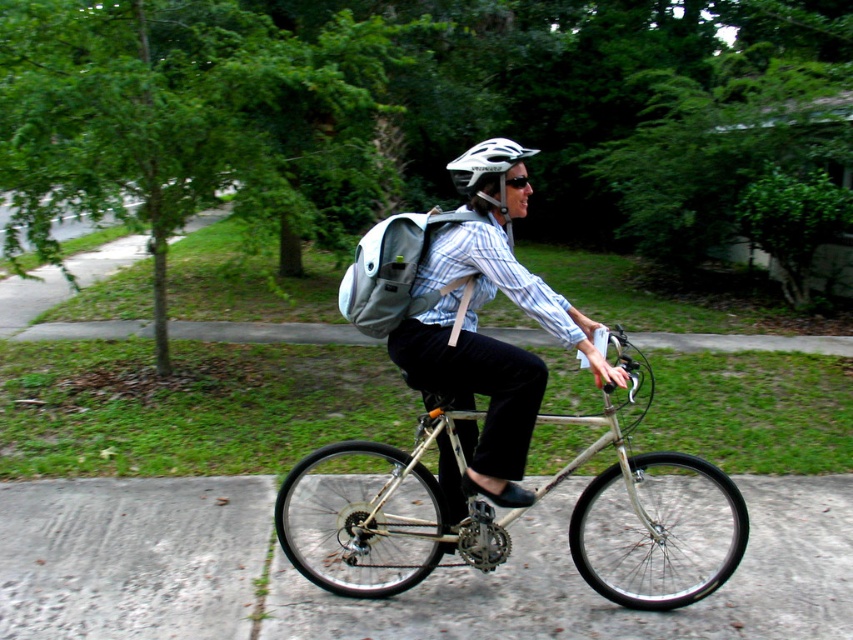
Who is taller, matte gray backpack at center or white matte bicycle helmet at center?

white matte bicycle helmet at center

Does matte gray backpack at center appear under white matte bicycle helmet at center?

Yes.

Is point (456, 515) behind point (500, 195)?

That is True.

Where is `matte gray backpack at center`? The image size is (853, 640). matte gray backpack at center is located at coordinates (485, 336).

Is point (399, 504) positioned in front of point (462, 177)?

That is False.

Between silver metallic bicycle at center and white matte bicycle helmet at center, which one appears on the left side from the viewer's perspective?

Positioned to the left is silver metallic bicycle at center.

Who is more forward, (422, 429) or (463, 186)?

Point (463, 186)

You are a GUI agent. You are given a task and a screenshot of the screen. Output one action in this format:
    pyautogui.click(x=<x>, y=<y>)
    Task: Click on the silver metallic bicycle at center
    This screenshot has width=853, height=640.
    Given the screenshot: What is the action you would take?
    pyautogui.click(x=380, y=515)

Which is below, silver metallic bicycle at center or matte gray backpack at center?

Positioned lower is silver metallic bicycle at center.

Is point (653, 509) positioned before point (514, 298)?

No, (653, 509) is behind (514, 298).

Locate an element on the screen. The height and width of the screenshot is (640, 853). silver metallic bicycle at center is located at coordinates (380, 515).